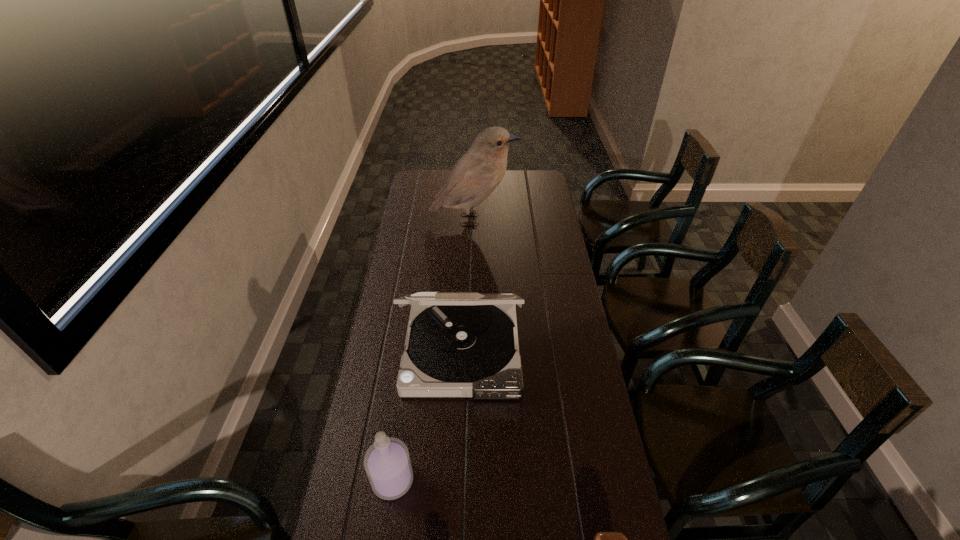
Locate an element on the screen. The width and height of the screenshot is (960, 540). the farthest object is located at coordinates (478, 172).

Find the location of a particular element. Image resolution: width=960 pixels, height=540 pixels. the tallest object is located at coordinates (478, 172).

This screenshot has height=540, width=960. I want to click on CD player, so click(458, 344).

This screenshot has width=960, height=540. Identify the location of the second tallest object. (458, 344).

At what (x,y) coordinates should I click in order to perform the action: click on the left perfume. Please return your answer as a coordinate pair (x, y). Image resolution: width=960 pixels, height=540 pixels. Looking at the image, I should click on (387, 463).

Identify the location of the farther perfume. (387, 463).

This screenshot has height=540, width=960. Find the location of `free point located on the face of the parakeet`. free point located on the face of the parakeet is located at coordinates (535, 220).

Where is `vacant space located on the control panel of the second farthest object`? The width and height of the screenshot is (960, 540). vacant space located on the control panel of the second farthest object is located at coordinates [x=455, y=523].

Identify the location of vacant area situated 0.070m on the front of the second nearest object. The height and width of the screenshot is (540, 960). (385, 531).

This screenshot has width=960, height=540. In order to click on parakeet present at the left edge in this screenshot , I will do `click(478, 172)`.